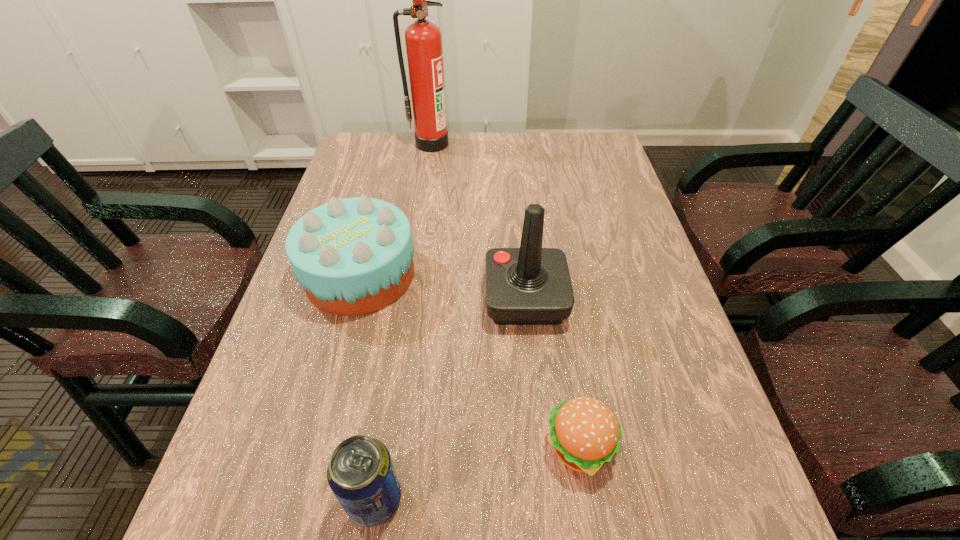
The image size is (960, 540). I want to click on vacant space that is in between the joystick and the farthest object, so click(x=478, y=221).

Identify the location of empty space that is in between the fourth shortest object and the soda. This screenshot has height=540, width=960. (450, 399).

Find the location of a particular element. This screenshot has width=960, height=540. empty location between the cake and the hamburger is located at coordinates (470, 360).

At what (x,y) coordinates should I click in order to perform the action: click on free space between the cake and the hamburger. Please return your answer as a coordinate pair (x, y). This screenshot has height=540, width=960. Looking at the image, I should click on (470, 360).

Locate an element on the screen. This screenshot has width=960, height=540. vacant space in between the fourth shortest object and the cake is located at coordinates (443, 287).

You are a GUI agent. You are given a task and a screenshot of the screen. Output one action in this format:
    pyautogui.click(x=<x>, y=<y>)
    Task: Click on the blank region between the soda and the joystick
    The width and height of the screenshot is (960, 540).
    Given the screenshot: What is the action you would take?
    pyautogui.click(x=450, y=399)

Find the location of `free spot between the cake and the second tallest object`. free spot between the cake and the second tallest object is located at coordinates click(x=443, y=287).

Identify the location of object that ranks as the second closest to the cake. (361, 474).

Where is `the fourth closest object to the soda`? the fourth closest object to the soda is located at coordinates (423, 39).

Identify the location of vacant point that satisfies the following two spatial constraints: 1. on the front side of the cake; 2. on the left side of the hamburger. (315, 446).